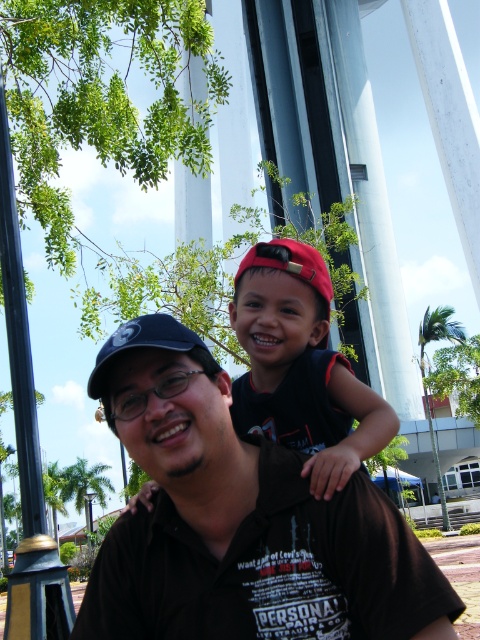
Identify the location of matte red cap at upper center. (300, 365).

Which is in front, point (311, 317) or point (147, 339)?

Point (147, 339) is in front.

I want to click on matte red cap at upper center, so click(300, 365).

Is matte black shirt at center to the right of matte red cap at upper center from the viewer's perspective?

Incorrect, matte black shirt at center is not on the right side of matte red cap at upper center.

Is matte black shirt at center wider than matte red cap at upper center?

Correct, the width of matte black shirt at center exceeds that of matte red cap at upper center.

Is point (298, 490) closer to viewer compared to point (288, 316)?

Yes, it is.

The height and width of the screenshot is (640, 480). What are the coordinates of `matte black shirt at center` in the screenshot? It's located at (240, 520).

This screenshot has width=480, height=640. Identify the location of matte red cap at upper center. (300, 365).

Which is above, matte red cap at upper center or brushed metal lamp post at left?

matte red cap at upper center

The height and width of the screenshot is (640, 480). I want to click on matte red cap at upper center, so click(300, 365).